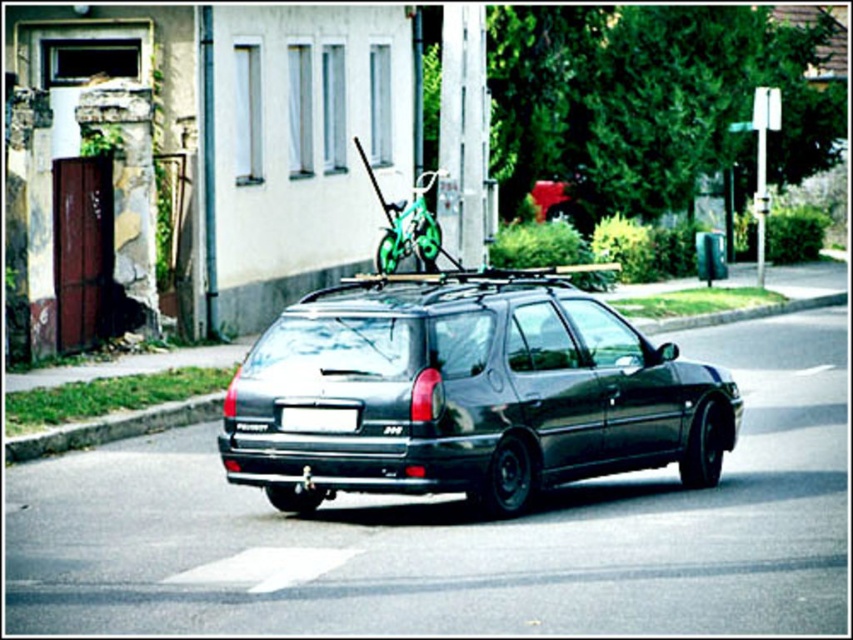
Can you confirm if shiny black car at center is taller than white plastic license plate at rear?

Yes.

Is point (556, 465) positioned after point (357, 410)?

Yes.

This screenshot has height=640, width=853. Find the location of `shiny black car at center`. shiny black car at center is located at coordinates (468, 392).

Can you confirm if shiny black car at center is wider than green matte bicycle at center?

No, shiny black car at center is not wider than green matte bicycle at center.

Is the position of shiny black car at center more distant than that of green matte bicycle at center?

No, it is in front of green matte bicycle at center.

Does point (393, 369) come in front of point (425, 248)?

Yes.

Identify the location of shiny black car at center. The height and width of the screenshot is (640, 853). (468, 392).

Is green grass at lower left taller than white plastic license plate at rear?

Indeed, green grass at lower left has a greater height compared to white plastic license plate at rear.

Is green grass at lower left positioned behind white plastic license plate at rear?

Yes.

The width and height of the screenshot is (853, 640). In order to click on green grass at lower left in this screenshot , I will do `click(112, 428)`.